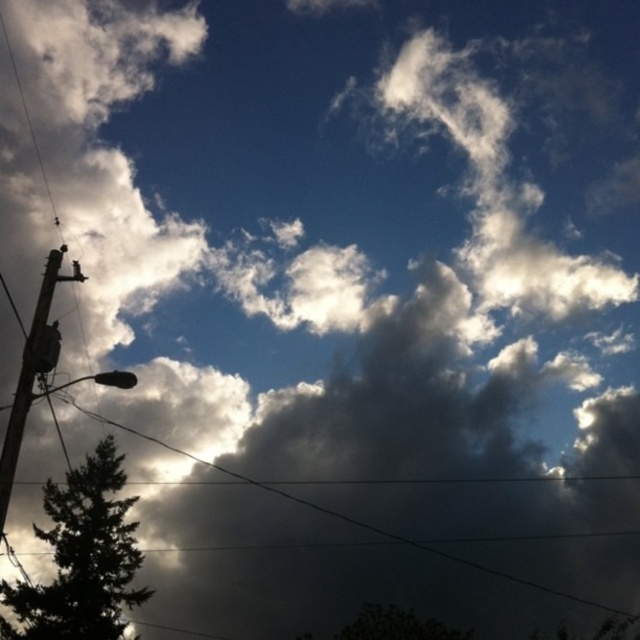
Question: Which point is closer to the camera?

Choices:
 (A) silhouette wooden pole at left
 (B) dark green leafy tree at lower left

Answer: (A)

Question: Among these points, which one is nearest to the camera?

Choices:
 (A) (33, 358)
 (B) (12, 593)

Answer: (A)

Question: Does dark green leafy tree at lower left have a smaller size compared to silhouette wooden pole at left?

Choices:
 (A) yes
 (B) no

Answer: (A)

Question: Is dark green leafy tree at lower left thinner than silhouette wooden pole at left?

Choices:
 (A) yes
 (B) no

Answer: (A)

Question: Can you confirm if dark green leafy tree at lower left is smaller than silhouette wooden pole at left?

Choices:
 (A) no
 (B) yes

Answer: (B)